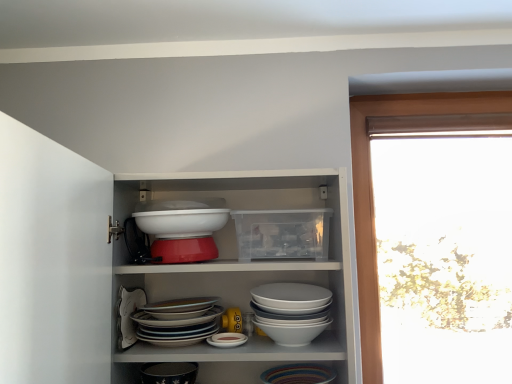
Question: Can you confirm if matte black bowl at lower center is shorter than white glossy bowls at center, the 2th bowl when ordered from top to bottom?

Choices:
 (A) no
 (B) yes

Answer: (B)

Question: Is matte black bowl at lower center turned away from white glossy bowls at center, acting as the 2th bowl starting from the bottom?

Choices:
 (A) yes
 (B) no

Answer: (B)

Question: Is matte black bowl at lower center closer to the viewer compared to white glossy bowls at center, the 2th bowl when ordered from top to bottom?

Choices:
 (A) yes
 (B) no

Answer: (B)

Question: Does matte black bowl at lower center touch white glossy bowls at center, acting as the 2th bowl starting from the bottom?

Choices:
 (A) no
 (B) yes

Answer: (A)

Question: Does matte black bowl at lower center have a smaller size compared to white glossy bowls at center, acting as the 2th bowl starting from the bottom?

Choices:
 (A) no
 (B) yes

Answer: (B)

Question: From a real-world perspective, is matte black bowl at lower center located higher than white glossy bowls at center, acting as the 2th bowl starting from the bottom?

Choices:
 (A) yes
 (B) no

Answer: (B)

Question: Is white glossy bowl at center, which ranks as the 1th bowl in bottom-to-top order, to the left of white glossy bowls at center, the 2th bowl when ordered from top to bottom, from the viewer's perspective?

Choices:
 (A) no
 (B) yes

Answer: (B)

Question: Can you confirm if white glossy bowl at center, which ranks as the 1th bowl in bottom-to-top order, is bigger than white glossy bowls at center, the 2th bowl when ordered from top to bottom?

Choices:
 (A) no
 (B) yes

Answer: (B)

Question: Can white glossy bowls at center, acting as the 2th bowl starting from the bottom, be found inside white glossy bowl at center, which ranks as the 1th bowl in bottom-to-top order?

Choices:
 (A) no
 (B) yes

Answer: (A)

Question: Does white glossy bowl at center, which ranks as the 1th bowl in bottom-to-top order, have a lesser height compared to white glossy bowls at center, acting as the 2th bowl starting from the bottom?

Choices:
 (A) yes
 (B) no

Answer: (A)

Question: Could you tell me if white glossy bowl at center, which ranks as the 1th bowl in bottom-to-top order, is facing white glossy bowls at center, acting as the 2th bowl starting from the bottom?

Choices:
 (A) yes
 (B) no

Answer: (B)

Question: Is white glossy bowl at center, which ranks as the 1th bowl in bottom-to-top order, not within white glossy bowls at center, the 2th bowl when ordered from top to bottom?

Choices:
 (A) no
 (B) yes

Answer: (B)

Question: Does white glossy bowl at center, the 3th bowl in the top-to-bottom sequence, have a larger size compared to matte black bowl at lower center?

Choices:
 (A) yes
 (B) no

Answer: (A)